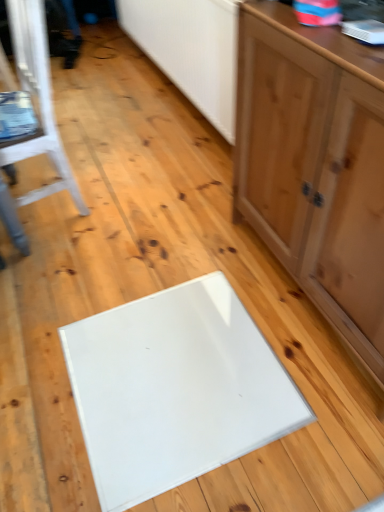
Question: Considering the positions of matte wood cabinet at right and white painted wood chair at left in the image, is matte wood cabinet at right taller or shorter than white painted wood chair at left?

Choices:
 (A) short
 (B) tall

Answer: (B)

Question: In terms of width, does matte wood cabinet at right look wider or thinner when compared to white painted wood chair at left?

Choices:
 (A) thin
 (B) wide

Answer: (A)

Question: Is matte wood cabinet at right to the left or to the right of white painted wood chair at left in the image?

Choices:
 (A) right
 (B) left

Answer: (A)

Question: Is white painted wood chair at left inside the boundaries of matte wood cabinet at right, or outside?

Choices:
 (A) inside
 (B) outside

Answer: (B)

Question: Is point (51, 130) positioned closer to the camera than point (319, 248)?

Choices:
 (A) closer
 (B) farther

Answer: (B)

Question: From a real-world perspective, is white painted wood chair at left physically located above or below matte wood cabinet at right?

Choices:
 (A) below
 (B) above

Answer: (A)

Question: Visually, is white painted wood chair at left positioned to the left or to the right of matte wood cabinet at right?

Choices:
 (A) left
 (B) right

Answer: (A)